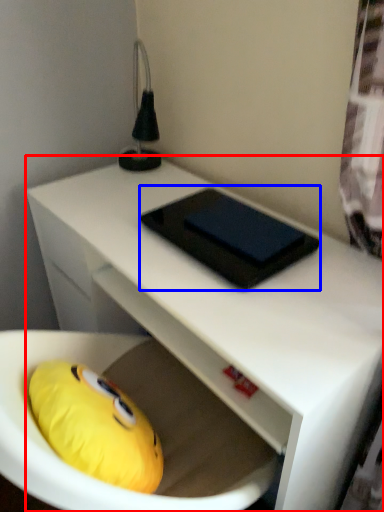
Question: Which point is closer to the camera, desk (highlighted by a red box) or pad (highlighted by a blue box)?

Choices:
 (A) desk
 (B) pad

Answer: (A)